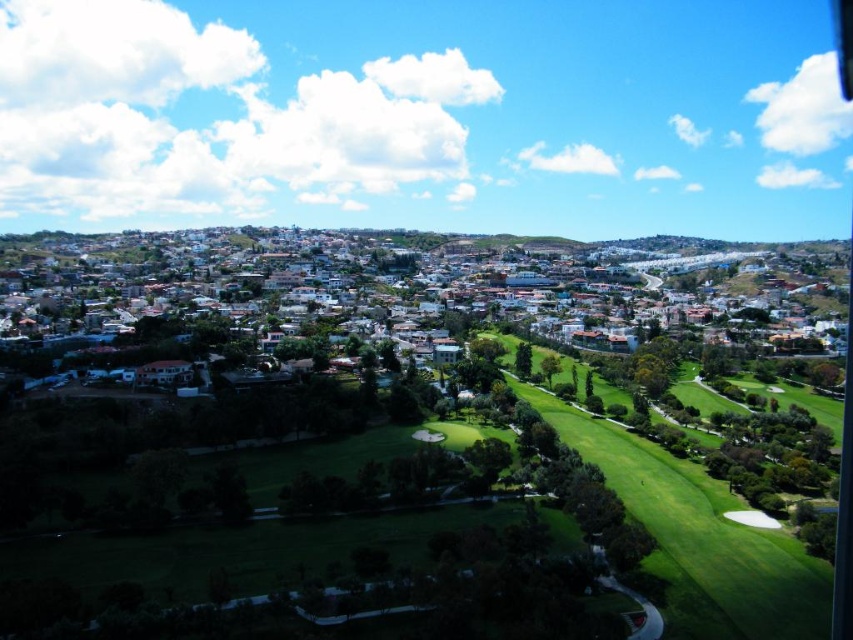
Which is more to the left, white matte houses at center or green grassy golf course at center?

Positioned to the left is white matte houses at center.

Is white matte houses at center in front of green grassy golf course at center?

No, it is not.

You are a GUI agent. You are given a task and a screenshot of the screen. Output one action in this format:
    pyautogui.click(x=<x>, y=<y>)
    Task: Click on the white matte houses at center
    
    Given the screenshot: What is the action you would take?
    pyautogui.click(x=389, y=275)